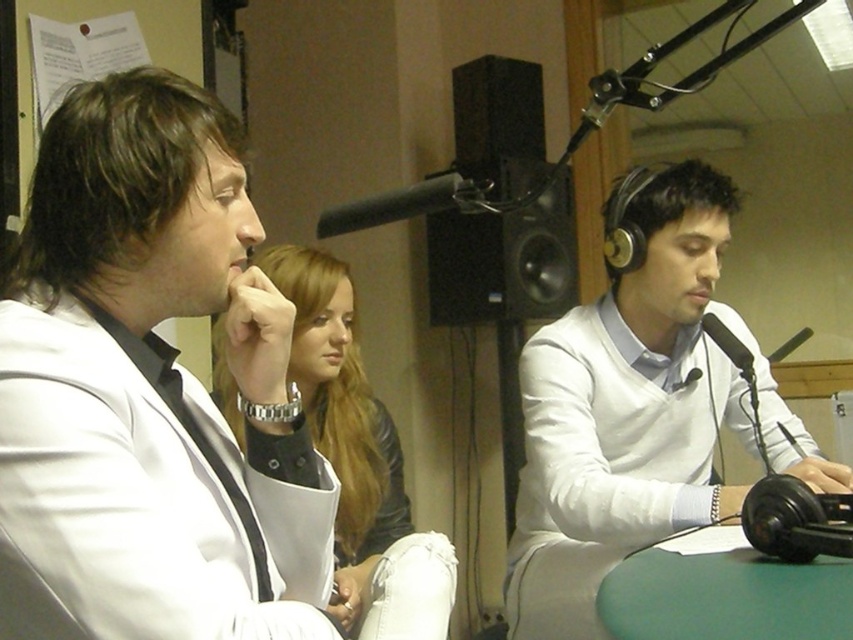
Question: Is black matte microphone at upper center smaller than black matte microphone at right?

Choices:
 (A) no
 (B) yes

Answer: (A)

Question: Which point is farther to the camera?

Choices:
 (A) white matte sweater at center
 (B) leather jacket at center

Answer: (A)

Question: Where is black matte microphone at right located in relation to metallic silver microphone at center in the image?

Choices:
 (A) right
 (B) left

Answer: (B)

Question: Which point appears farthest from the camera in this image?

Choices:
 (A) [x=532, y=259]
 (B) [x=325, y=420]
 (C) [x=733, y=410]

Answer: (A)

Question: Which object is the closest to the green matte table at lower center?

Choices:
 (A) black matte speaker at center
 (B) white matte sweater at center

Answer: (B)

Question: In this image, where is white matte sweater at center located relative to black matte microphone at right?

Choices:
 (A) below
 (B) above

Answer: (A)